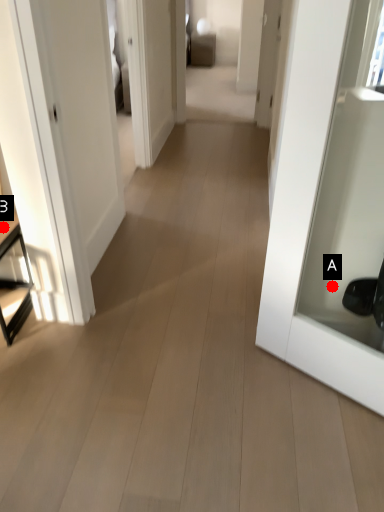
Question: Two points are circled on the image, labeled by A and B beside each circle. Which point appears closest to the camera in this image?

Choices:
 (A) A is closer
 (B) B is closer

Answer: (A)